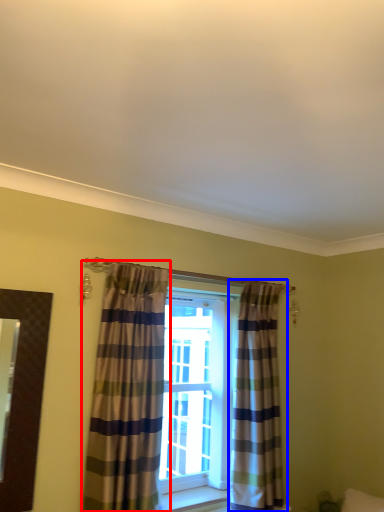
Question: Which object appears farthest to the camera in this image, curtain (highlighted by a red box) or curtain (highlighted by a blue box)?

Choices:
 (A) curtain
 (B) curtain

Answer: (B)